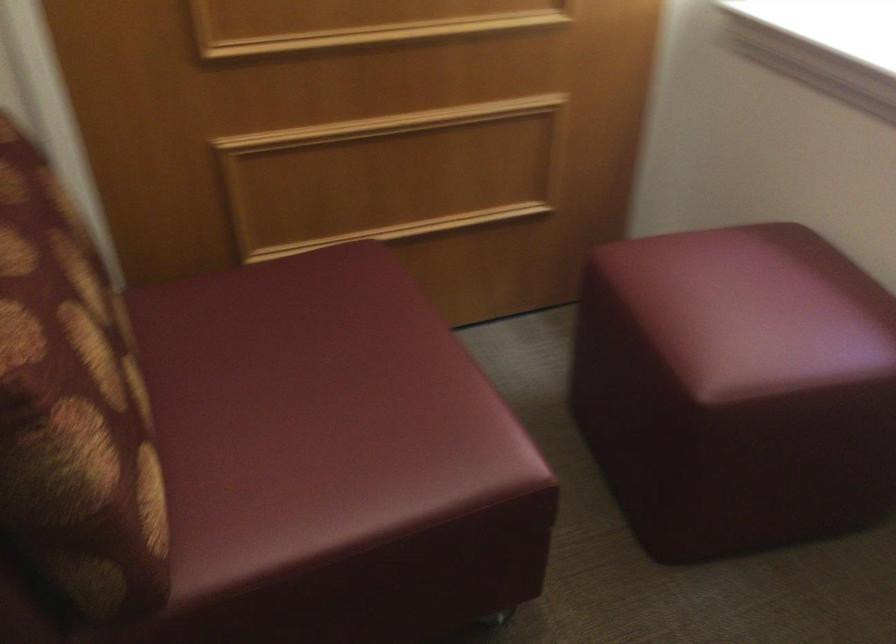
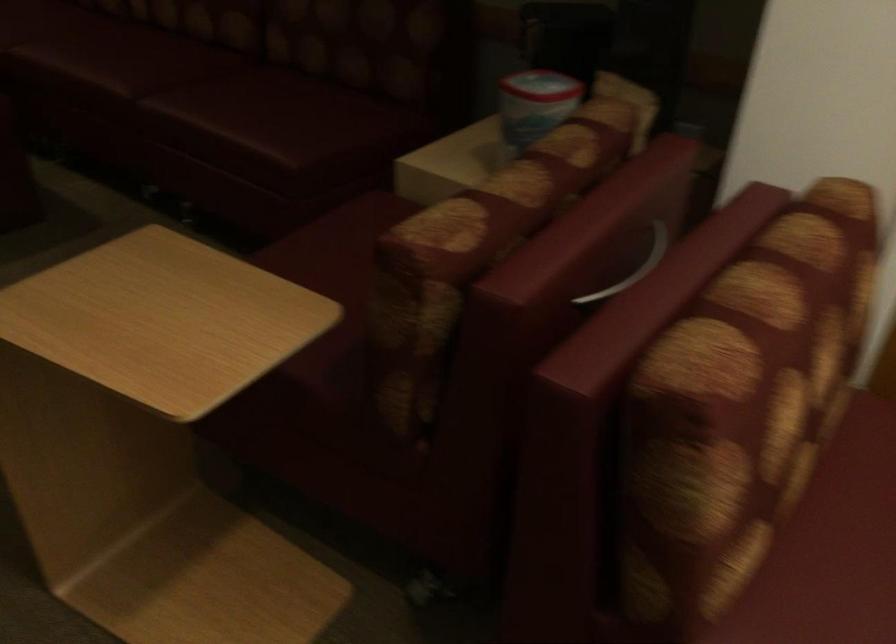
Question: The camera is either moving clockwise (left) or counter-clockwise (right) around the object. The first image is from the beginning of the video and the second image is from the end. Is the camera moving left or right when shooting the video?

Choices:
 (A) Left
 (B) Right

Answer: (B)